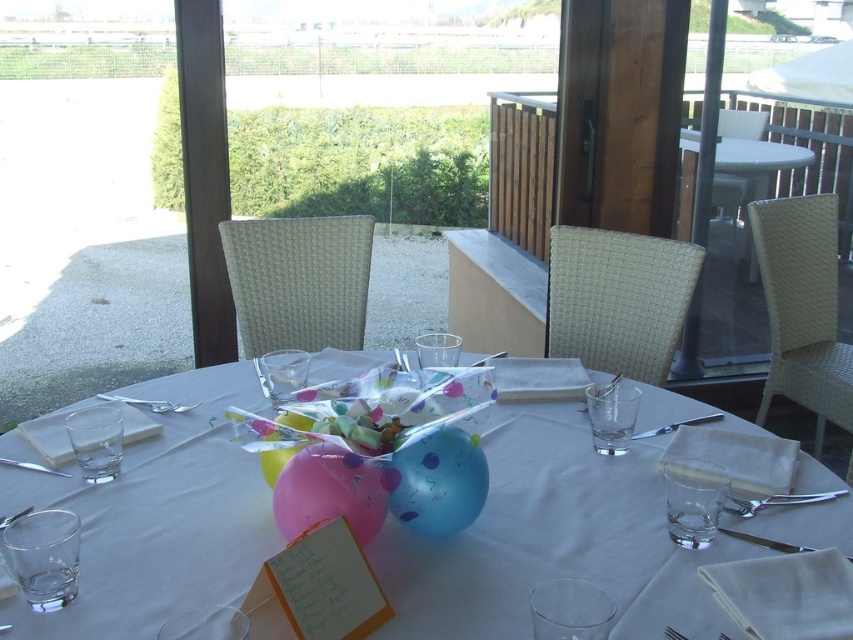
You are a guest at this outdoor dining setup and want to place your napkin on the table. Which object is closer to you, the translucent glass table at center or the shiny metallic knife at center?

The translucent glass table at center is closer to the viewer than the shiny metallic knife at center, so you should place your napkin on the translucent glass table at center.